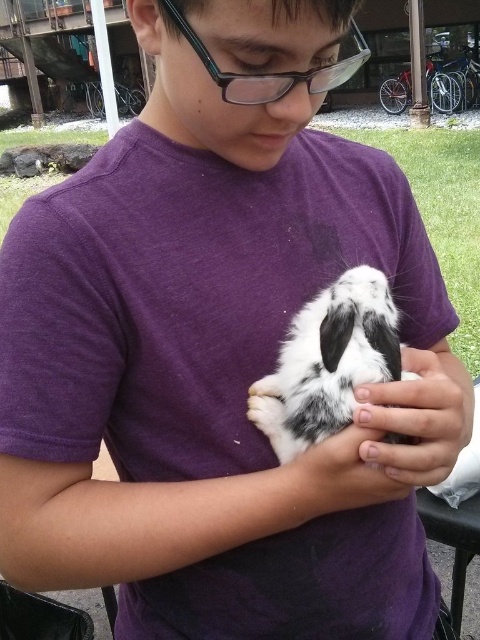
Can you confirm if spotted fur rabbit at center is smaller than smooth skin hand at center?

Yes.

Can you confirm if spotted fur rabbit at center is thinner than smooth skin hand at center?

Yes, spotted fur rabbit at center is thinner than smooth skin hand at center.

Is point (396, 356) positioned before point (431, 445)?

That is False.

Find the location of a particular element. The height and width of the screenshot is (640, 480). spotted fur rabbit at center is located at coordinates (328, 362).

Is point (320, 435) behind point (244, 84)?

Yes.

Who is positioned more to the right, spotted fur rabbit at center or black plastic glasses at upper center?

From the viewer's perspective, spotted fur rabbit at center appears more on the right side.

Does point (307, 388) come behind point (268, 88)?

Yes, point (307, 388) is behind point (268, 88).

Where is `spotted fur rabbit at center`? The image size is (480, 640). spotted fur rabbit at center is located at coordinates (328, 362).

Can you confirm if smooth skin hand at center is positioned to the right of black plastic glasses at upper center?

Yes, smooth skin hand at center is to the right of black plastic glasses at upper center.

Which is behind, point (422, 472) or point (263, 84)?

The point (422, 472) is behind.

Locate an element on the screen. The image size is (480, 640). smooth skin hand at center is located at coordinates (419, 417).